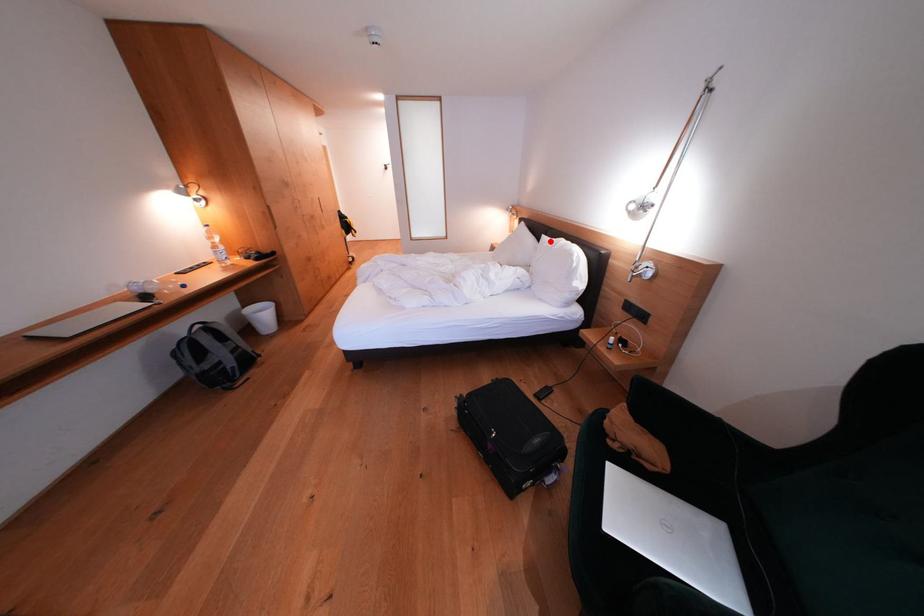
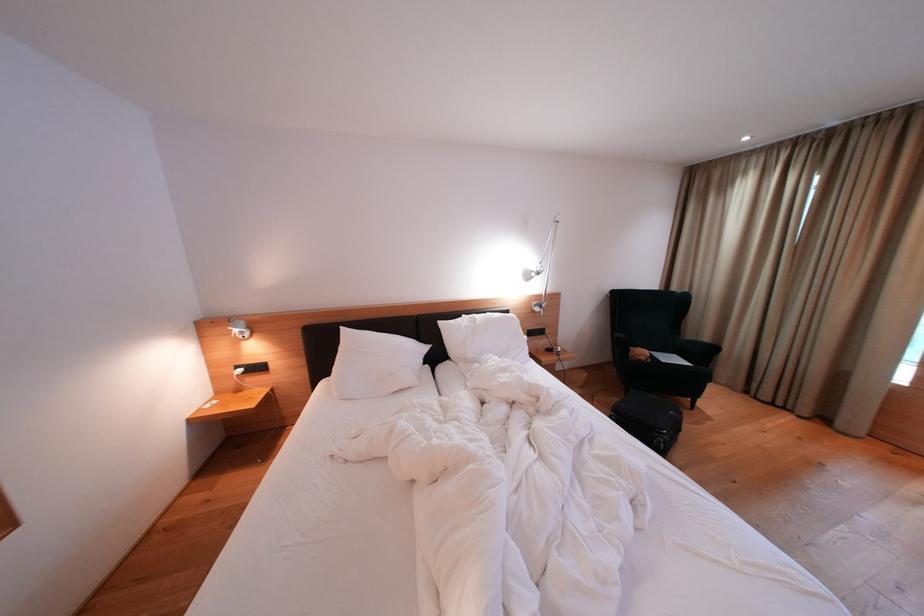
Question: I am providing you with two images of the same scene from different viewpoints. Given a red point in image1, look at the same physical point in image2. Is it:

Choices:
 (A) Closer to the viewpoint
 (B) Farther from the viewpoint

Answer: (B)